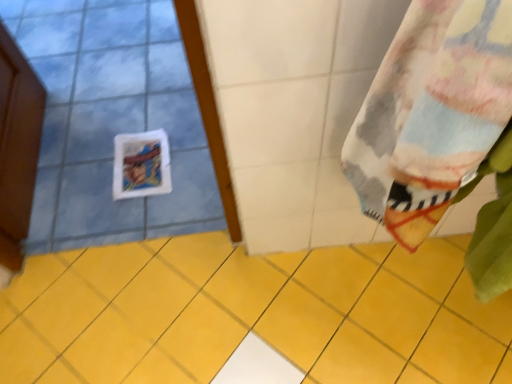
Question: Should I look upward or downward to see yellow ceramic tile at center?

Choices:
 (A) down
 (B) up

Answer: (A)

Question: Is yellow ceramic tile at center not within fluffy multicolored towel at right?

Choices:
 (A) yes
 (B) no

Answer: (A)

Question: Is yellow ceramic tile at center oriented away from fluffy multicolored towel at right?

Choices:
 (A) no
 (B) yes

Answer: (A)

Question: Does yellow ceramic tile at center have a lesser width compared to fluffy multicolored towel at right?

Choices:
 (A) no
 (B) yes

Answer: (A)

Question: Does yellow ceramic tile at center have a lesser height compared to fluffy multicolored towel at right?

Choices:
 (A) yes
 (B) no

Answer: (A)

Question: From the image's perspective, does yellow ceramic tile at center appear higher than fluffy multicolored towel at right?

Choices:
 (A) yes
 (B) no

Answer: (B)

Question: Is yellow ceramic tile at center not near fluffy multicolored towel at right?

Choices:
 (A) no
 (B) yes

Answer: (A)

Question: Is fluffy multicolored towel at right at the right side of yellow ceramic tile at center?

Choices:
 (A) no
 (B) yes

Answer: (B)

Question: Considering the relative sizes of fluffy multicolored towel at right and yellow ceramic tile at center in the image provided, is fluffy multicolored towel at right thinner than yellow ceramic tile at center?

Choices:
 (A) no
 (B) yes

Answer: (B)

Question: Could you tell me if fluffy multicolored towel at right is facing yellow ceramic tile at center?

Choices:
 (A) yes
 (B) no

Answer: (B)

Question: From the image's perspective, does fluffy multicolored towel at right appear higher than yellow ceramic tile at center?

Choices:
 (A) no
 (B) yes

Answer: (B)

Question: Is fluffy multicolored towel at right at the left side of yellow ceramic tile at center?

Choices:
 (A) no
 (B) yes

Answer: (A)

Question: Is fluffy multicolored towel at right not within yellow ceramic tile at center?

Choices:
 (A) yes
 (B) no

Answer: (A)

Question: Is point (271, 329) closer or farther from the camera than point (463, 28)?

Choices:
 (A) farther
 (B) closer

Answer: (A)